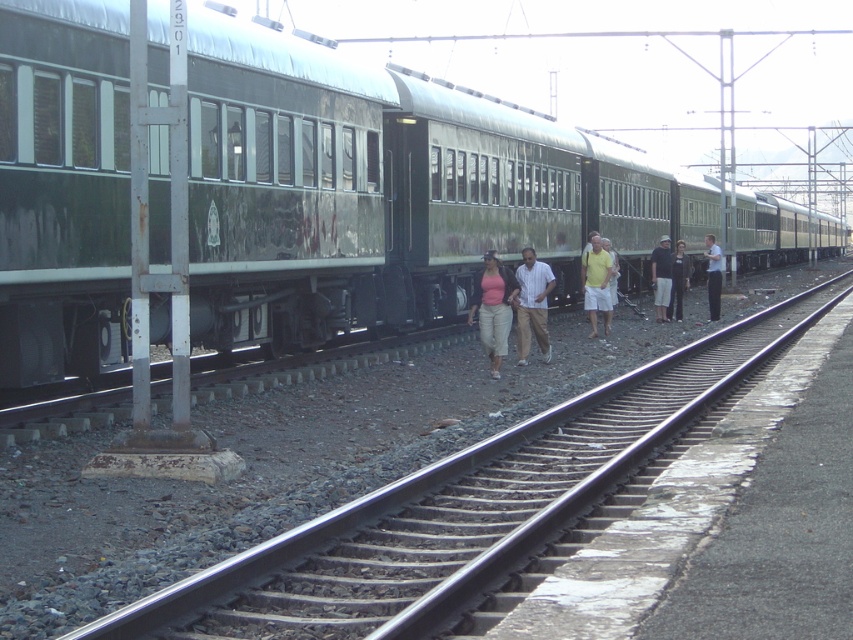
Who is taller, green metallic train car at center or matte pink shirt at center?

green metallic train car at center is taller.

Is green metallic train car at center shorter than matte pink shirt at center?

In fact, green metallic train car at center may be taller than matte pink shirt at center.

Identify the location of green metallic train car at center. Image resolution: width=853 pixels, height=640 pixels. (386, 192).

Between light brown cotton shirt at center and yellow cotton shirt at center, which one appears on the right side from the viewer's perspective?

yellow cotton shirt at center is more to the right.

Does light brown cotton shirt at center appear over yellow cotton shirt at center?

No.

Image resolution: width=853 pixels, height=640 pixels. What do you see at coordinates (532, 305) in the screenshot?
I see `light brown cotton shirt at center` at bounding box center [532, 305].

Locate an element on the screen. light brown cotton shirt at center is located at coordinates (532, 305).

Who is taller, yellow cotton shirt at center or yellow cotton shorts at center?

Standing taller between the two is yellow cotton shirt at center.

Does point (587, 288) come behind point (613, 272)?

No.

Where is `yellow cotton shirt at center`? yellow cotton shirt at center is located at coordinates (596, 284).